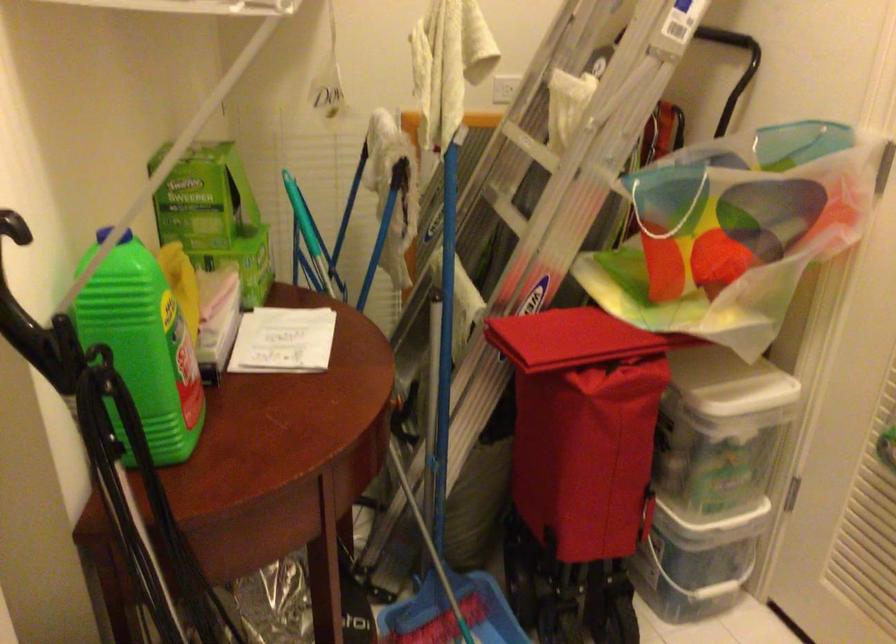
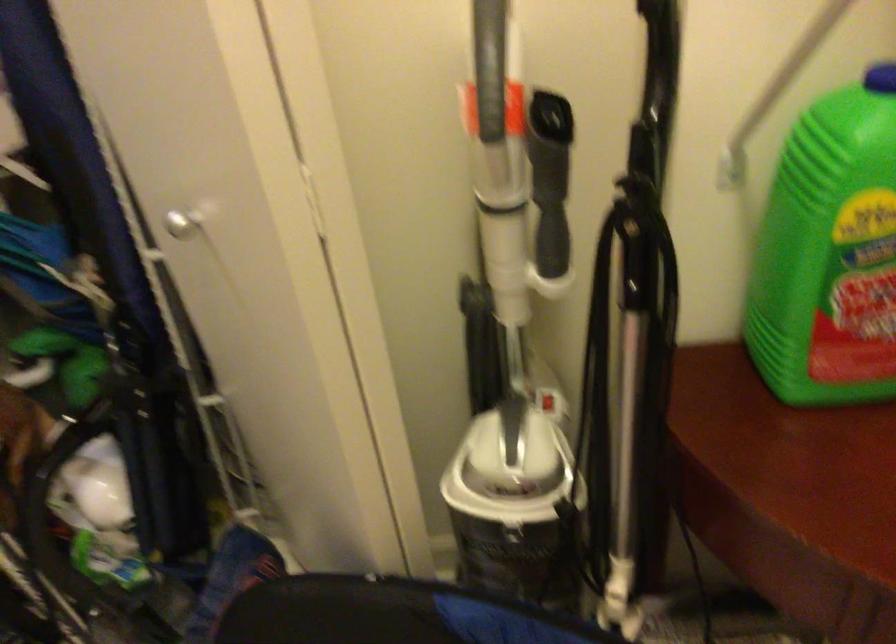
Where in the second image is the point corresponding to point (165, 341) from the first image?

(830, 252)